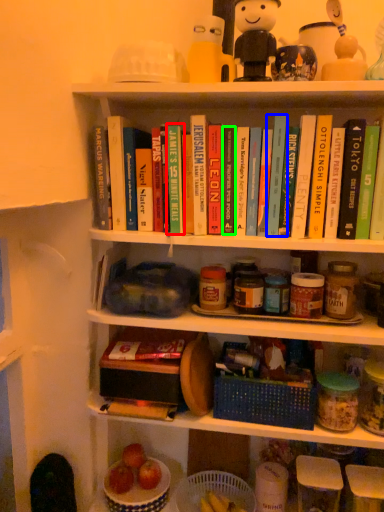
Question: Which is farther away from book (highlighted by a red box)? book (highlighted by a blue box) or book (highlighted by a green box)?

Choices:
 (A) book
 (B) book

Answer: (A)